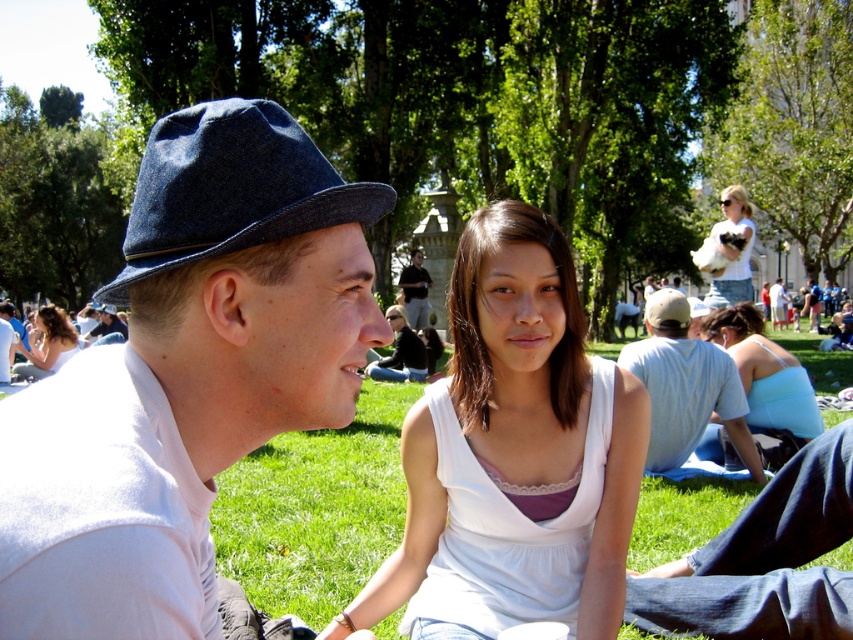
Between point (633, 422) and point (399, 378), which one is positioned in front?

Point (633, 422) is more forward.

Is white cotton tank top at center taller than matte black nose at center?

Indeed, white cotton tank top at center has a greater height compared to matte black nose at center.

Which is in front, point (529, 237) or point (399, 362)?

Point (529, 237)

This screenshot has height=640, width=853. What are the coordinates of `white cotton tank top at center` in the screenshot? It's located at (518, 422).

Can you confirm if light blue fabric top at lower right is positioned above dark blue denim jeans at center?

Actually, light blue fabric top at lower right is below dark blue denim jeans at center.

Does light blue fabric top at lower right have a larger size compared to dark blue denim jeans at center?

Indeed, light blue fabric top at lower right has a larger size compared to dark blue denim jeans at center.

Is point (775, 378) farther from viewer compared to point (410, 301)?

No, (775, 378) is in front of (410, 301).

In order to click on light blue fabric top at lower right in this screenshot , I will do `click(764, 372)`.

Can you confirm if denim hat at left is bigger than dark blue denim jeans at center?

Actually, denim hat at left might be smaller than dark blue denim jeans at center.

Is point (370, 208) positioned after point (415, 289)?

No.

Is point (158, 321) positioned before point (403, 289)?

Yes, point (158, 321) is closer to viewer.

Find the location of a particular element. The image size is (853, 640). denim hat at left is located at coordinates (186, 376).